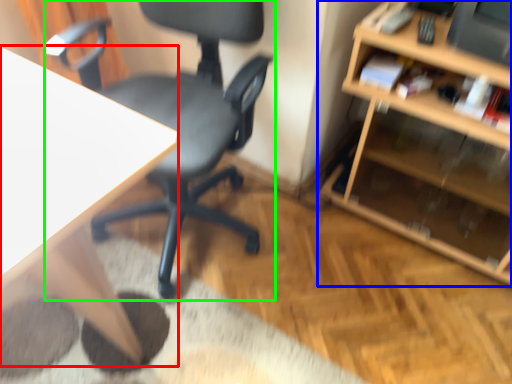
Question: Considering the real-world distances, which object is farthest from desk (highlighted by a red box)? shelf (highlighted by a blue box) or chair (highlighted by a green box)?

Choices:
 (A) shelf
 (B) chair

Answer: (A)